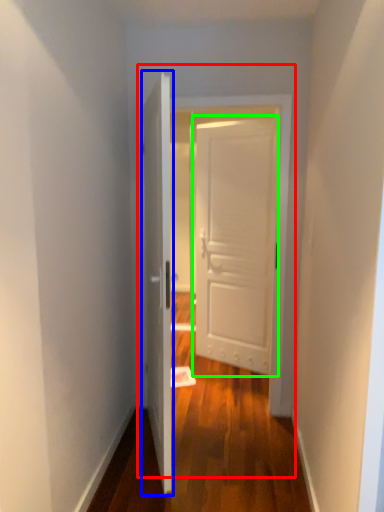
Question: Which object is positioned closest to door (highlighted by a red box)? Select from door (highlighted by a blue box) and door (highlighted by a green box).

Choices:
 (A) door
 (B) door

Answer: (A)